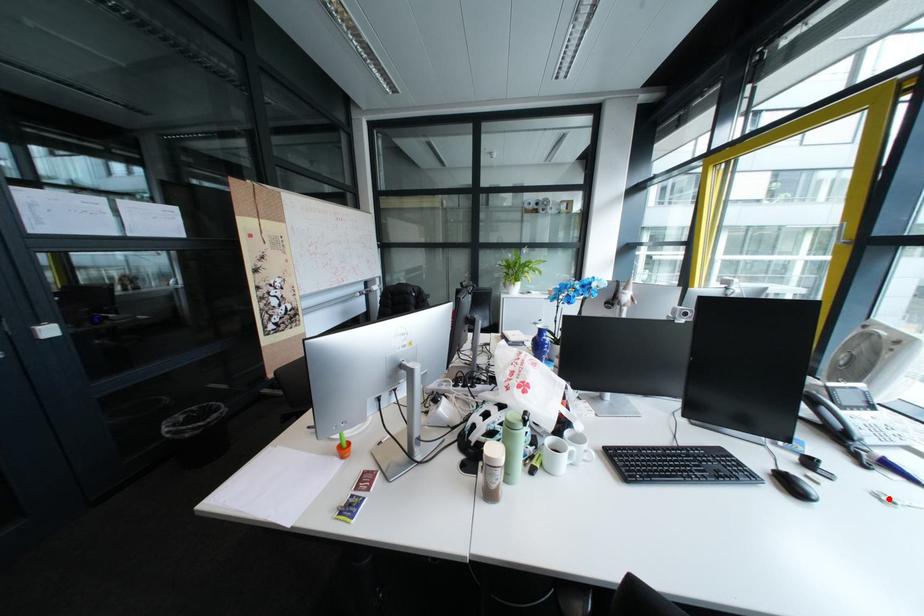
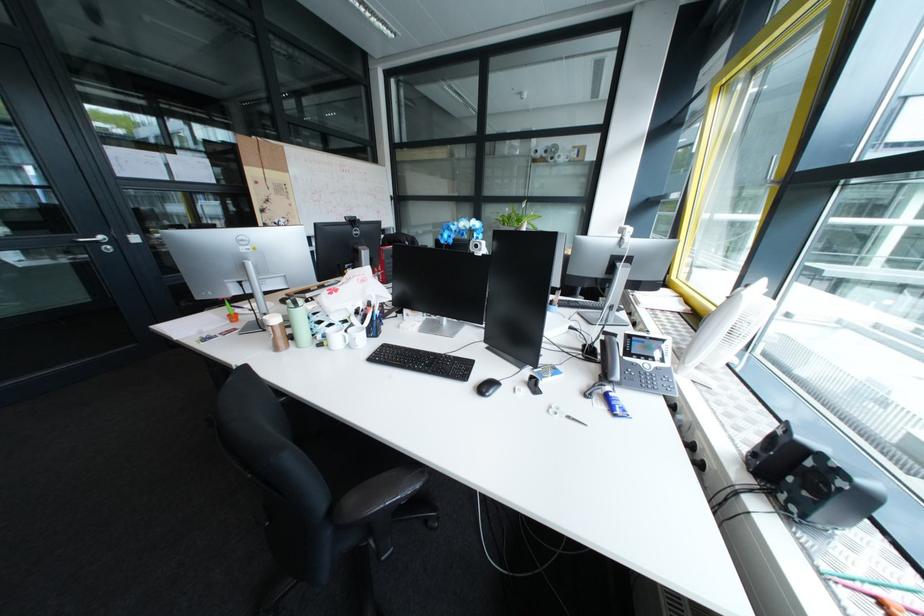
Locate, in the second image, the point that corresponds to the highlighted location in the first image.

(560, 408)